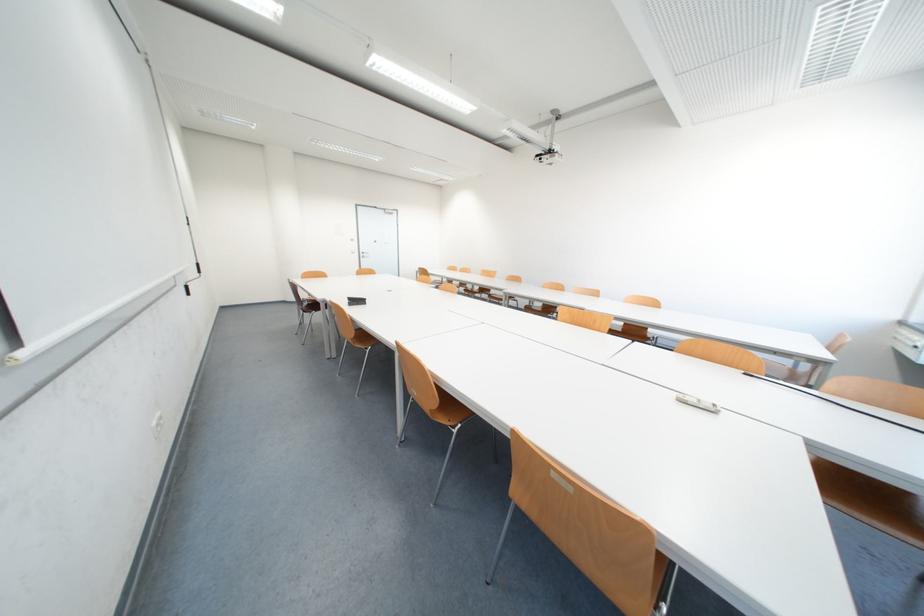
The height and width of the screenshot is (616, 924). What are the coordinates of `projector screen handle` in the screenshot? It's located at (698, 403).